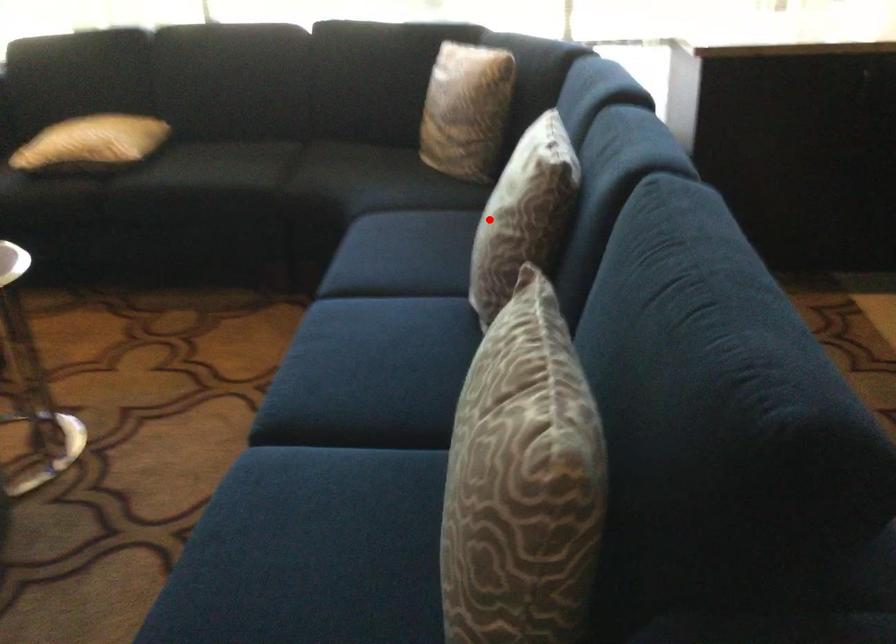
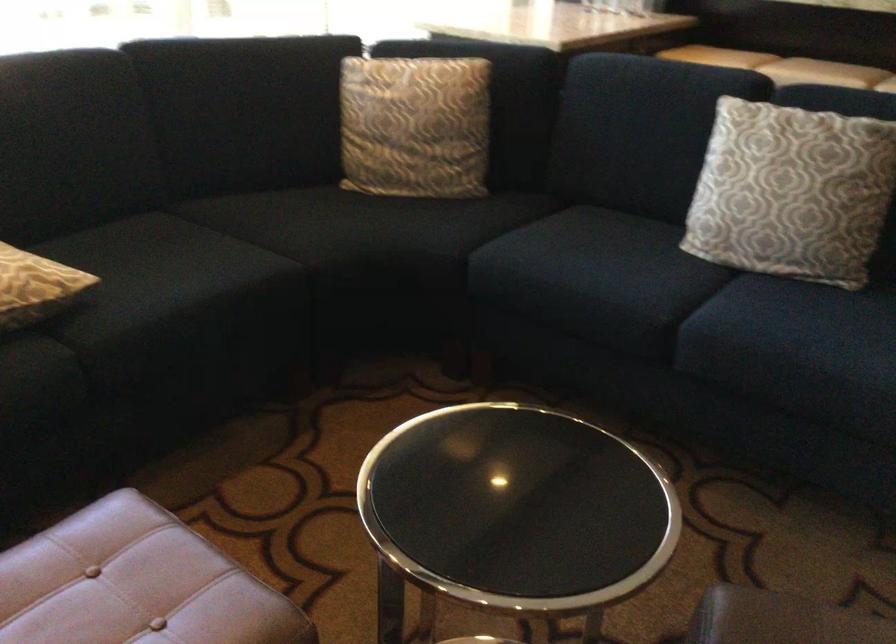
Question: I am providing you with two images of the same scene from different viewpoints. Image1 has a red point marked. In image2, the corresponding 3D location appears at what relative position? Reply with the corresponding letter.

Choices:
 (A) Closer
 (B) Farther

Answer: (B)